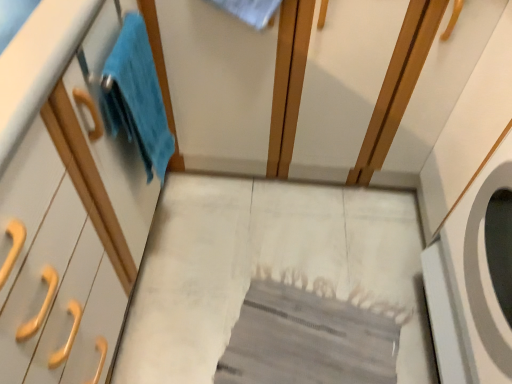
Question: Considering the positions of point (138, 86) and point (11, 44), is point (138, 86) closer or farther from the camera than point (11, 44)?

Choices:
 (A) closer
 (B) farther

Answer: (B)

Question: Is blue fluffy towel at left spatially inside white matte cabinet at left, or outside of it?

Choices:
 (A) inside
 (B) outside

Answer: (A)

Question: Is blue fluffy towel at left in front of or behind white matte cabinet at left in the image?

Choices:
 (A) behind
 (B) front

Answer: (A)

Question: From a real-world perspective, is white matte cabinet at left physically located above or below blue fluffy towel at left?

Choices:
 (A) above
 (B) below

Answer: (B)

Question: Visually, is white matte cabinet at left positioned to the left or to the right of blue fluffy towel at left?

Choices:
 (A) right
 (B) left

Answer: (B)

Question: Is point (53, 375) closer or farther from the camera than point (134, 92)?

Choices:
 (A) farther
 (B) closer

Answer: (B)

Question: Considering the positions of white matte cabinet at left and blue fluffy towel at left in the image, is white matte cabinet at left wider or thinner than blue fluffy towel at left?

Choices:
 (A) wide
 (B) thin

Answer: (A)